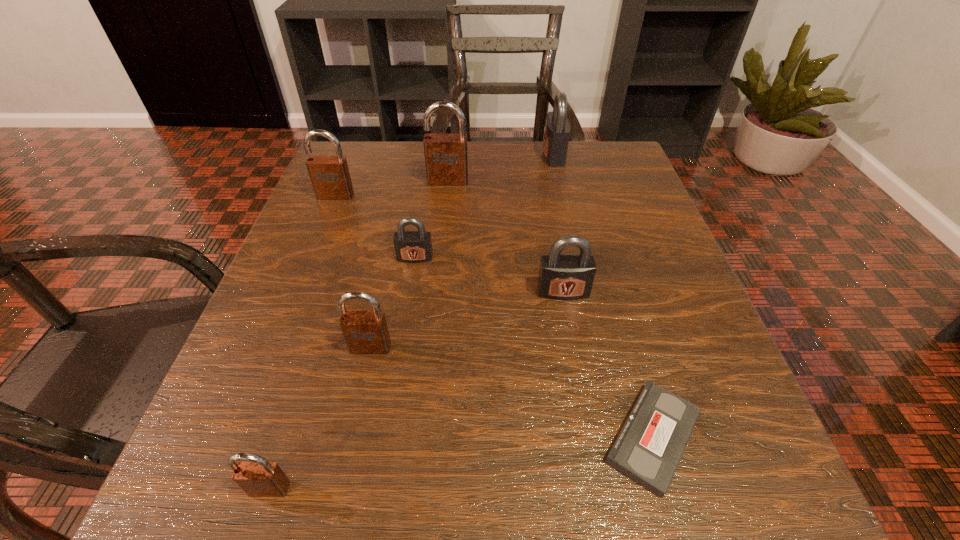
Locate an element on the screen. This screenshot has height=540, width=960. vacant area that satisfies the following two spatial constraints: 1. on the front of the videotape near the keyhole; 2. on the left side of the second smallest gray padlock is located at coordinates (x=589, y=437).

Image resolution: width=960 pixels, height=540 pixels. In order to click on free point that satisfies the following two spatial constraints: 1. on the front of the biggest gray padlock near the keyhole; 2. on the front of the second smallest gray padlock near the keyhole in this screenshot , I will do `click(586, 292)`.